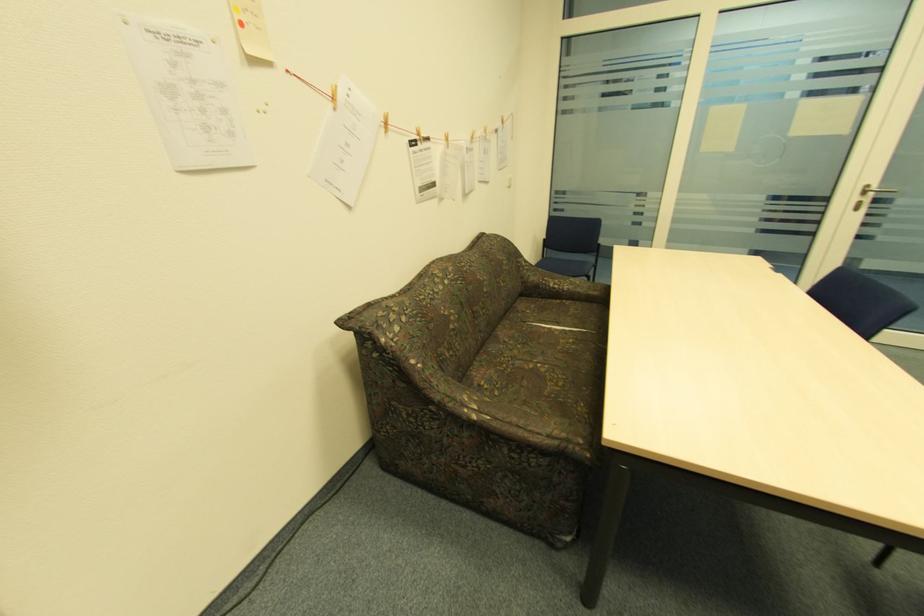
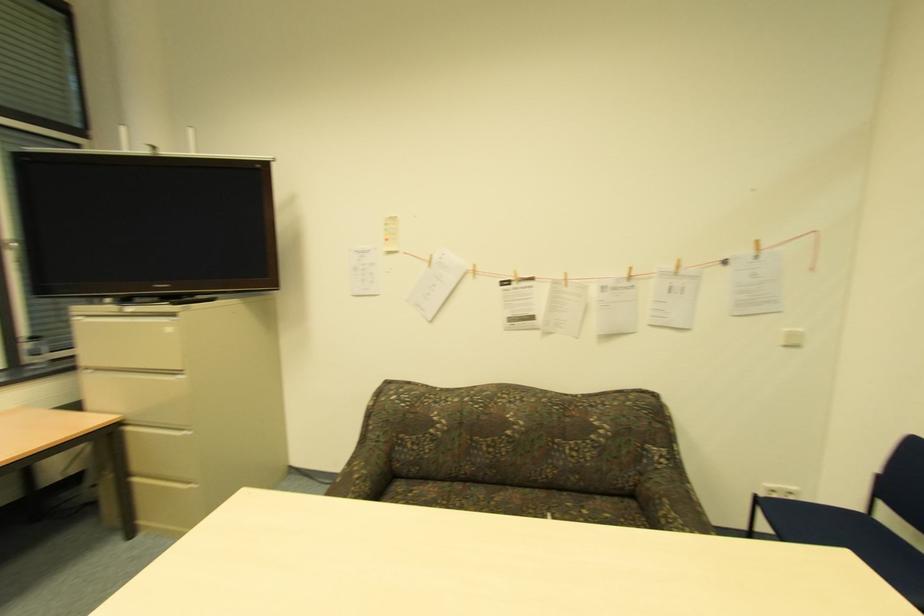
Find the pixel in the second image that matches (503,336) in the first image.

(505, 493)